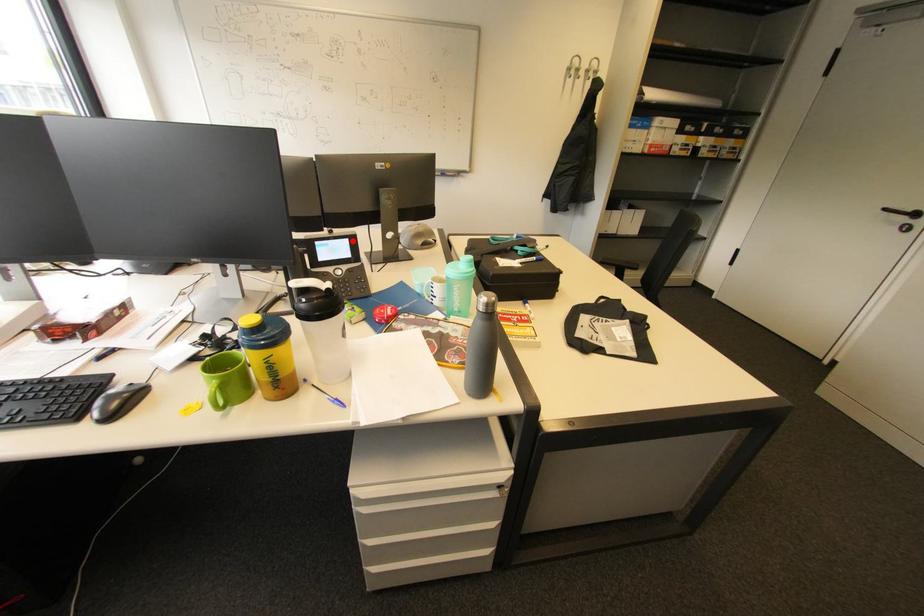
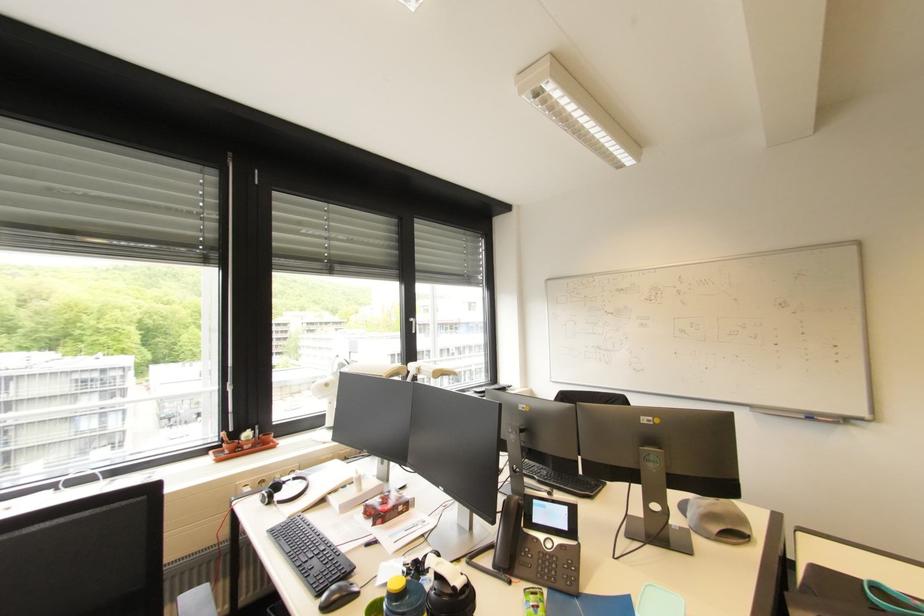
In the second image, find the point that corresponds to the highlighted location in the first image.

(572, 509)